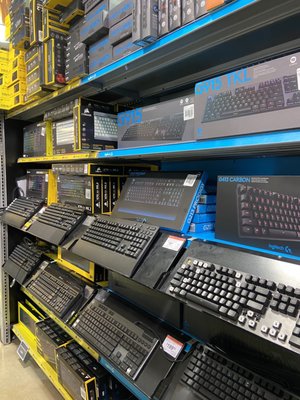
At what (x,y) coordinates should I click in order to perform the action: click on silver gray colored keyboard. Please return your answer as a coordinate pair (x, y). Looking at the image, I should click on (251, 260).